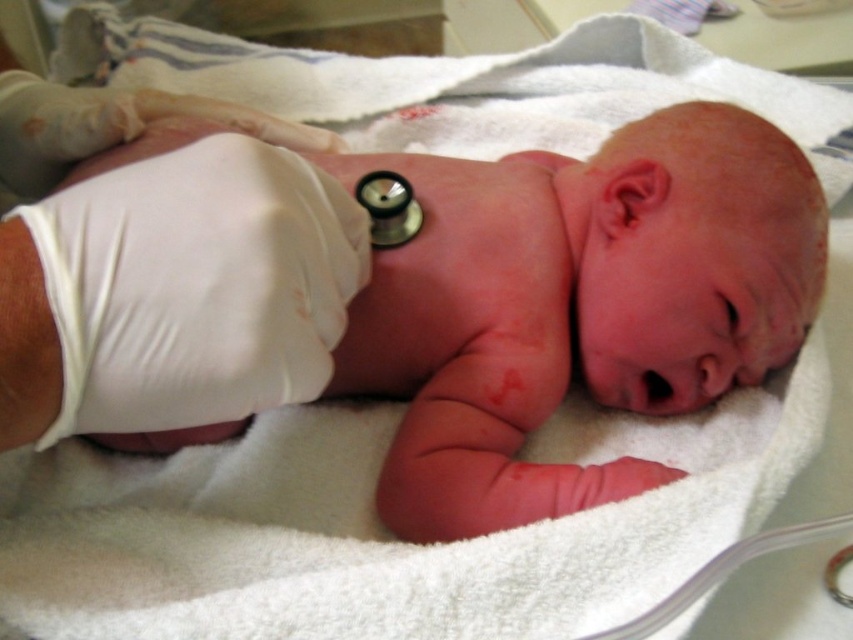
You are a nurse checking the baby in the image. Where is the pink smooth skin at center located on the baby?

The pink smooth skin at center is located at point (575, 305) on the baby.

Consider the image. You are a nurse in a hospital nursery. You need to check the baby for any skin conditions. The baby is lying on a white towel. You see the pink smooth skin at center and the white latex glove at center. Which object is positioned more to the right side?

The pink smooth skin at center is positioned to the right of the white latex glove at center, so the pink smooth skin at center is more to the right side.